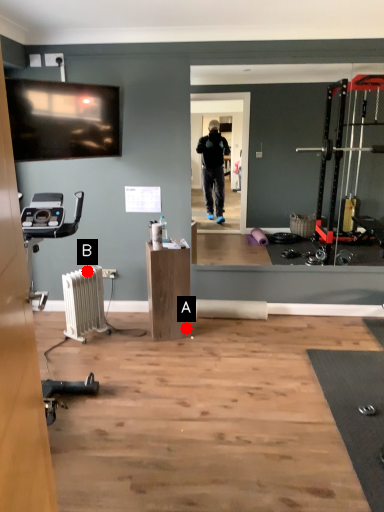
Question: Two points are circled on the image, labeled by A and B beside each circle. Which point appears farthest from the camera in this image?

Choices:
 (A) A is further
 (B) B is further

Answer: (A)